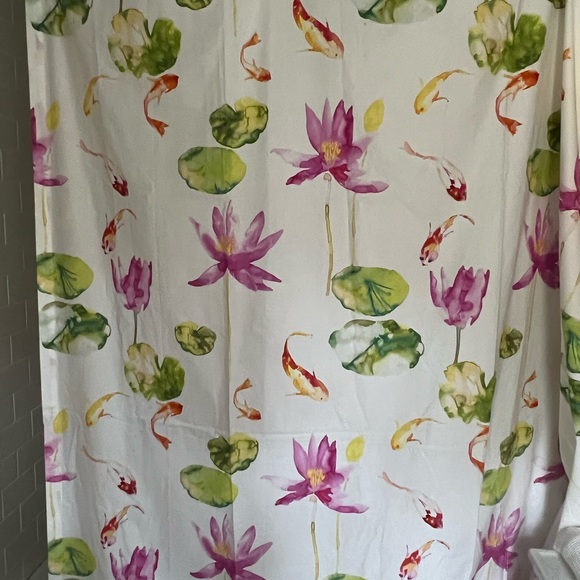
What are the coordinates of `counter` in the screenshot? It's located at (553, 571).